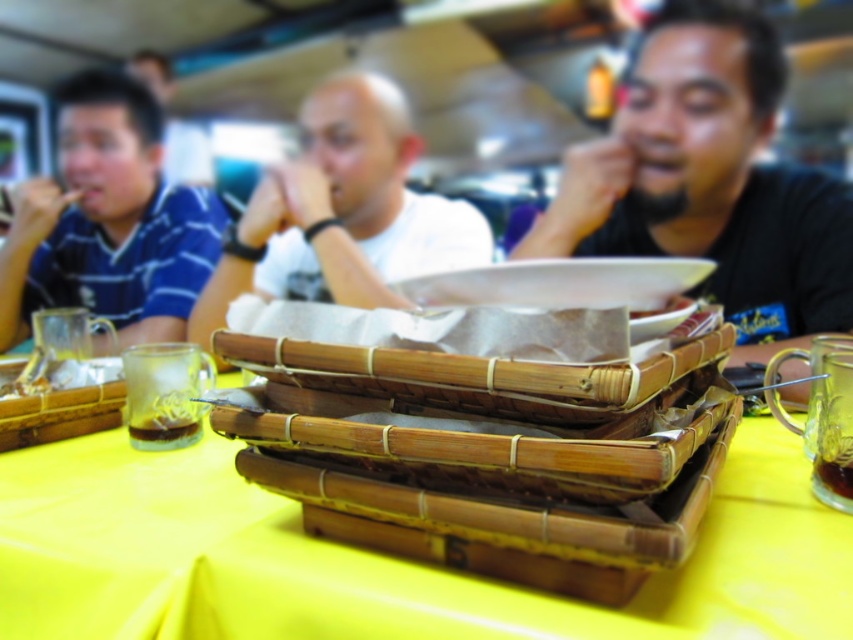
From the picture: You are a waiter at this restaurant and need to place a new order on the table. Where exactly should you put the new dish to ensure it is placed precisely on the white matte plate at center?

You should place the new dish at point coordinates of (341, 212) to ensure it is precisely on the white matte plate at center.